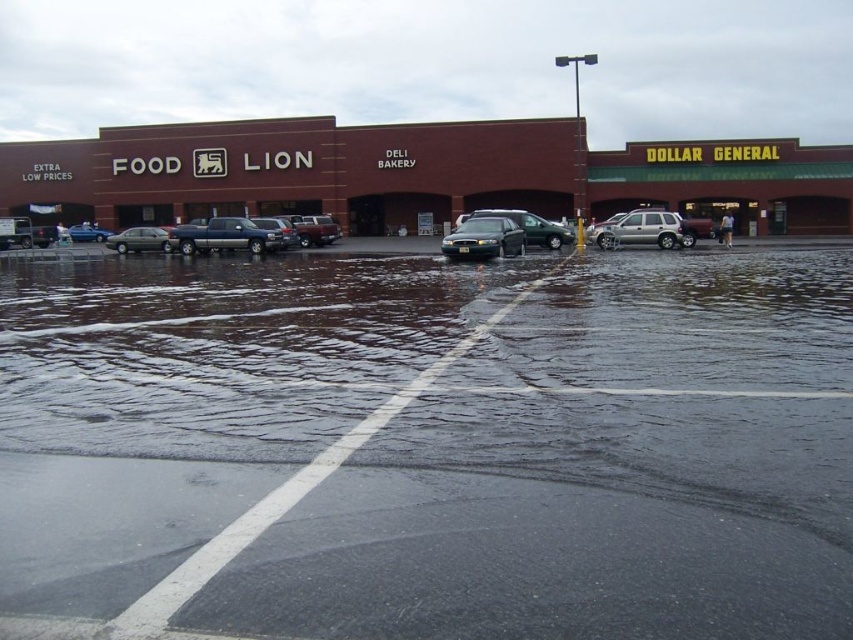
Is satin silver truck at center below matte gray sedan at left?

No.

Can you confirm if satin silver truck at center is positioned to the left of matte gray sedan at left?

Incorrect, satin silver truck at center is not on the left side of matte gray sedan at left.

Between point (207, 228) and point (120, 237), which one is positioned behind?

Positioned behind is point (120, 237).

Image resolution: width=853 pixels, height=640 pixels. What are the coordinates of `satin silver truck at center` in the screenshot? It's located at (224, 236).

Who is lower down, brown brick building at center or satin silver sedan at center?

satin silver sedan at center is below.

Find the location of a particular element. The width and height of the screenshot is (853, 640). brown brick building at center is located at coordinates (416, 173).

What are the coordinates of `brown brick building at center` in the screenshot? It's located at (416, 173).

What are the coordinates of `brown brick building at center` in the screenshot? It's located at (416, 173).

Is point (480, 225) farther from camera compared to point (300, 236)?

That is False.

Does satin black sedan at center appear over metallic silver suv at center?

No.

Who is more forward, (514, 243) or (321, 234)?

Point (514, 243) is in front.

Identify the location of satin black sedan at center. (485, 237).